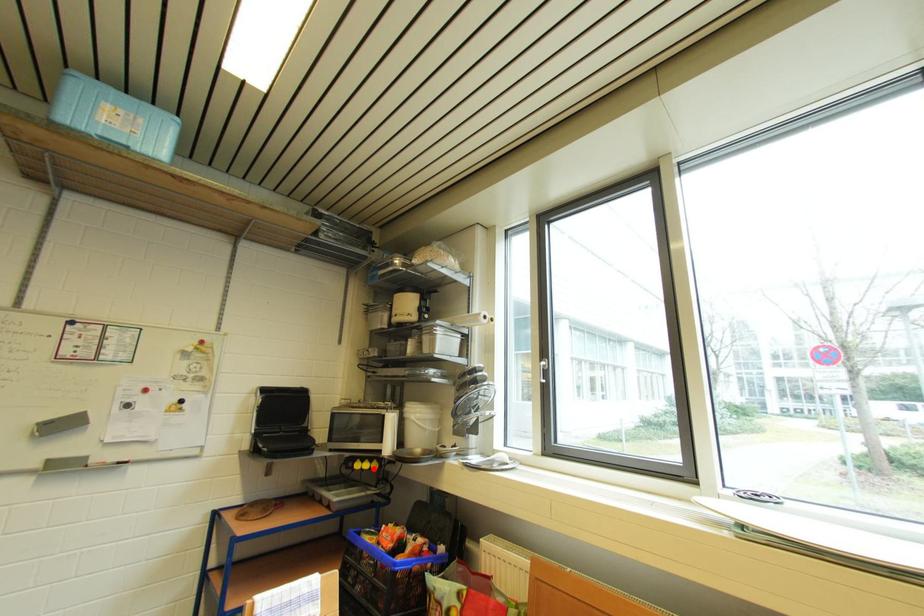
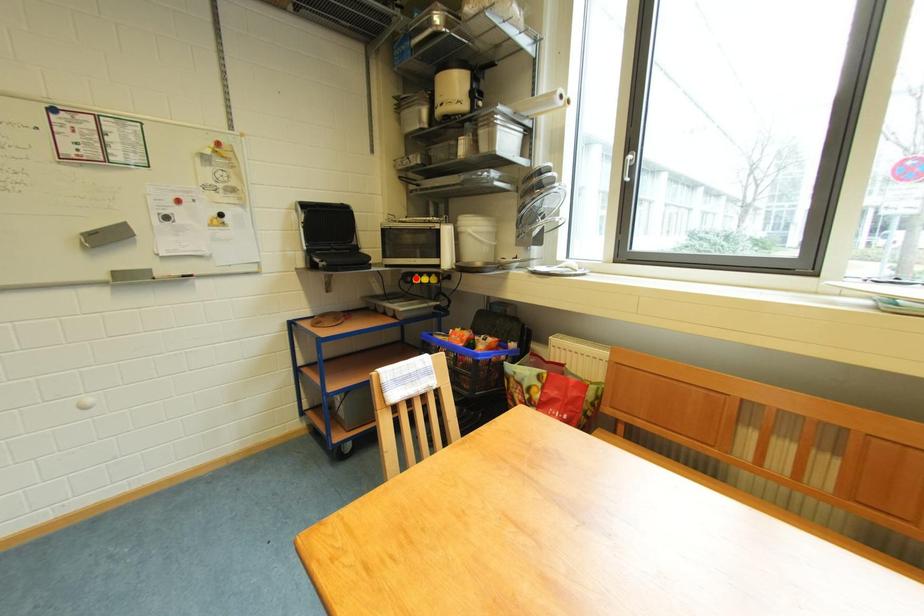
I am providing you with two images of the same scene from different viewpoints. A red point is marked on the first image and another point is marked on the second image. Is the red point in image1 aligned with the point shown in image2?

No